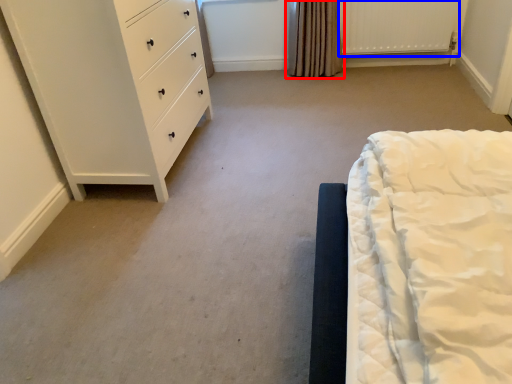
Question: Among these objects, which one is nearest to the camera, curtain (highlighted by a red box) or radiator (highlighted by a blue box)?

Choices:
 (A) curtain
 (B) radiator

Answer: (B)